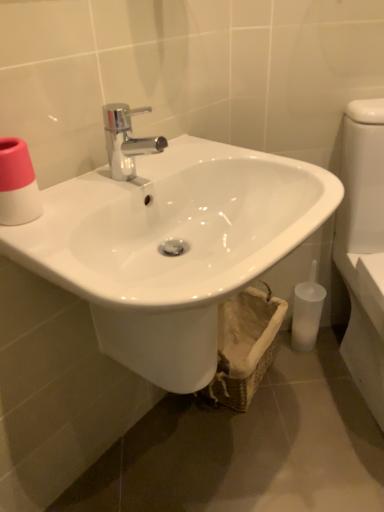
At what (x,y) coordinates should I click in order to perform the action: click on free point to the right of pink matte toilet paper at upper left. Please return your answer as a coordinate pair (x, y). Looking at the image, I should click on (85, 201).